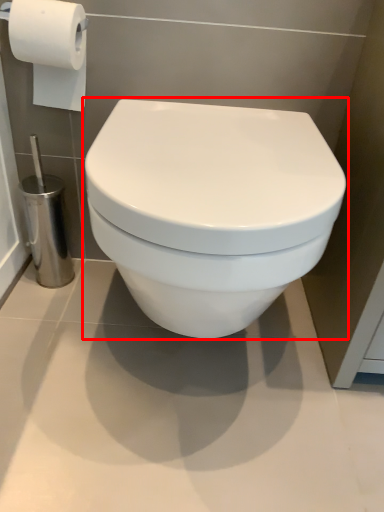
Question: From the image's perspective, where is toilet (annotated by the red box) located relative to toilet paper?

Choices:
 (A) above
 (B) below

Answer: (B)